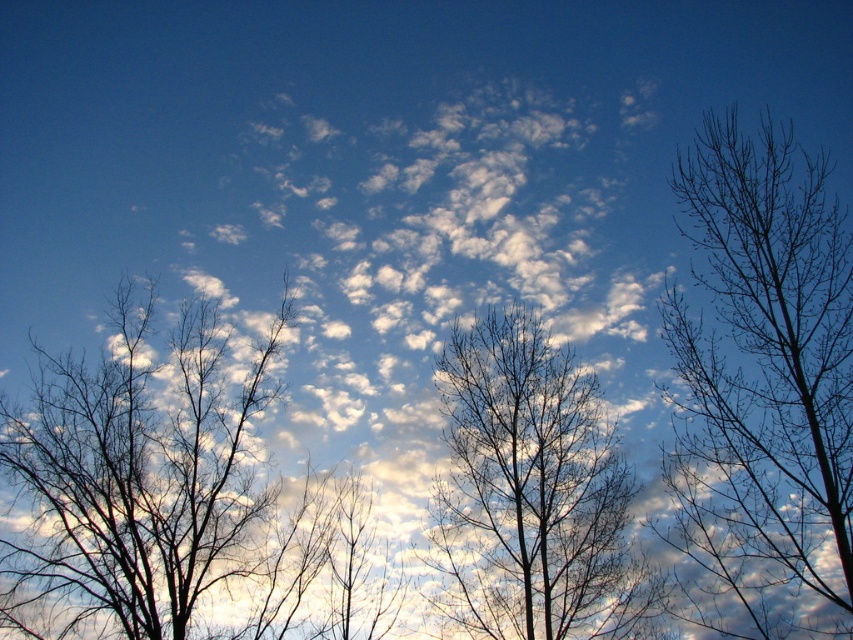
Is point (827, 164) positioned behind point (445, 576)?

No, it is in front of (445, 576).

Is bare branches at right taller than brown/dry wood tree at center?

Incorrect, bare branches at right's height is not larger of brown/dry wood tree at center's.

The width and height of the screenshot is (853, 640). I want to click on bare branches at right, so pyautogui.click(x=762, y=387).

Is bare branches at right taller than silhouette bare tree at left?

In fact, bare branches at right may be shorter than silhouette bare tree at left.

Between point (672, 340) and point (9, 573), which one is positioned behind?

The point (9, 573) is behind.

Is point (680, 506) more distant than point (97, 493)?

No.

At what (x,y) coordinates should I click in order to perform the action: click on bare branches at right. Please return your answer as a coordinate pair (x, y). Looking at the image, I should click on (762, 387).

Who is positioned more to the left, silhouette bare tree at left or brown/dry wood tree at center?

silhouette bare tree at left is more to the left.

Who is taller, silhouette bare tree at left or brown/dry wood tree at center?

Standing taller between the two is brown/dry wood tree at center.

The image size is (853, 640). Identify the location of silhouette bare tree at left. coord(136,477).

This screenshot has height=640, width=853. What are the coordinates of `silhouette bare tree at left` in the screenshot? It's located at (136, 477).